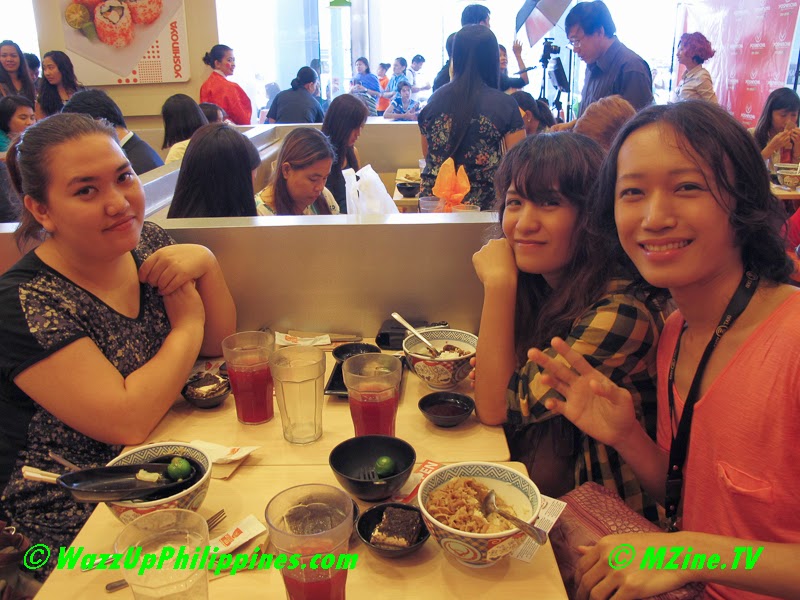
Locate an element on the screen. This screenshot has width=800, height=600. saucer is located at coordinates (334, 384).